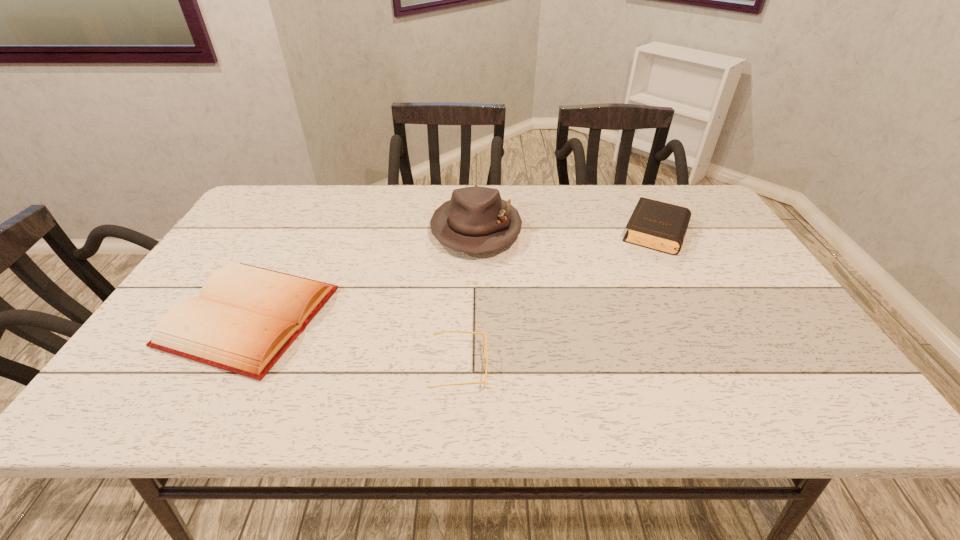
In the image, there is a desktop. Identify the location of vacant space at the left edge. (228, 242).

In the image, there is a desktop. Identify the location of vacant space at the right edge. This screenshot has height=540, width=960. (745, 308).

I want to click on free space at the near right corner of the desktop, so click(836, 404).

Identify the location of vacant area between the nearer Bible and the spectacles. The width and height of the screenshot is (960, 540). (354, 342).

Find the location of a particular element. empty space between the tallest object and the spectacles is located at coordinates (468, 299).

Where is `free space between the nearer Bible and the spectacles`? free space between the nearer Bible and the spectacles is located at coordinates (354, 342).

Find the location of a particular element. free space between the right Bible and the spectacles is located at coordinates (558, 300).

Locate an element on the screen. vacant point located between the spectacles and the tallest object is located at coordinates (468, 299).

Identify the location of unoccupied area between the spectacles and the left Bible. Image resolution: width=960 pixels, height=540 pixels. (354, 342).

Identify the location of free space between the spectacles and the hat. This screenshot has height=540, width=960. (468, 299).